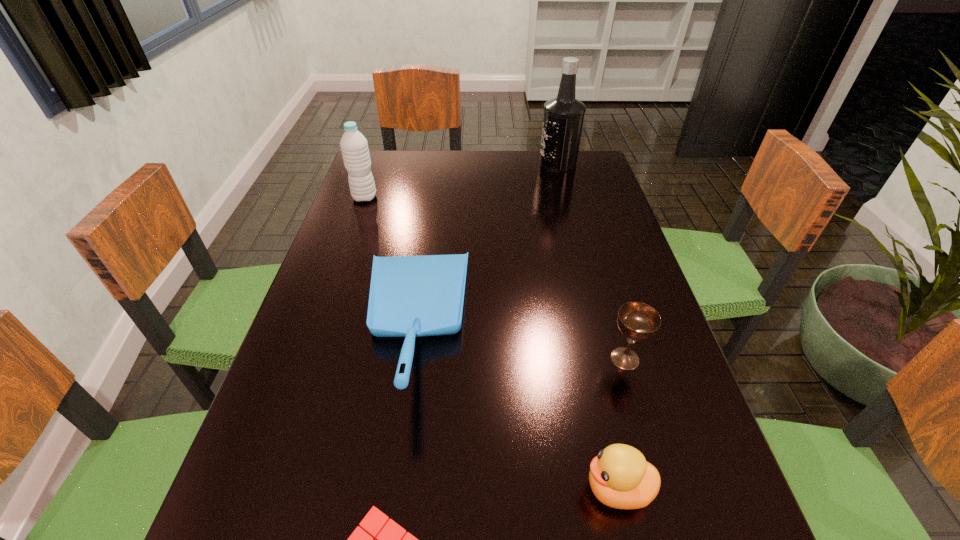
Image resolution: width=960 pixels, height=540 pixels. I want to click on liquor, so click(x=563, y=118).

This screenshot has height=540, width=960. In order to click on the tallest object in this screenshot , I will do `click(563, 118)`.

Where is `water bottle`? This screenshot has height=540, width=960. water bottle is located at coordinates (354, 146).

The height and width of the screenshot is (540, 960). I want to click on the second tallest object, so click(354, 146).

You are a GUI agent. You are given a task and a screenshot of the screen. Output one action in this format:
    pyautogui.click(x=<x>, y=<y>)
    Task: Click on the dustpan
    
    Given the screenshot: What is the action you would take?
    coord(410,296)

Where is `chalice`? The height and width of the screenshot is (540, 960). chalice is located at coordinates (638, 321).

I want to click on the second shortest object, so click(620, 477).

Find the location of a particular element. This screenshot has width=960, height=540. the second nearest object is located at coordinates pyautogui.click(x=620, y=477).

You are a GUI agent. You are given a task and a screenshot of the screen. Output one action in this format:
    pyautogui.click(x=<x>, y=<y>)
    Task: Click on the vacant region located 0.190m on the front label of the farthest object
    Image resolution: width=960 pixels, height=540 pixels.
    Given the screenshot: What is the action you would take?
    pyautogui.click(x=479, y=164)

Identify the location of blank area located 0.080m on the front label of the farthest object. (514, 164).